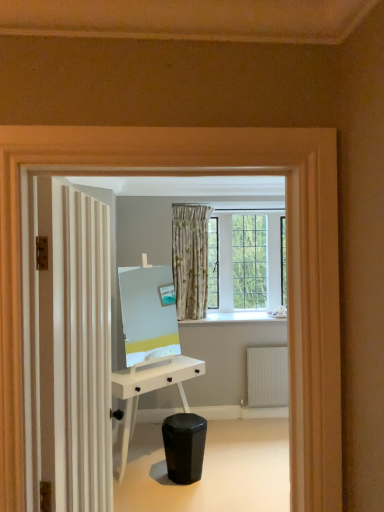
Locate an element on the screen. This screenshot has width=384, height=512. vacant space to the right of black matte swivel chair at lower center is located at coordinates (229, 480).